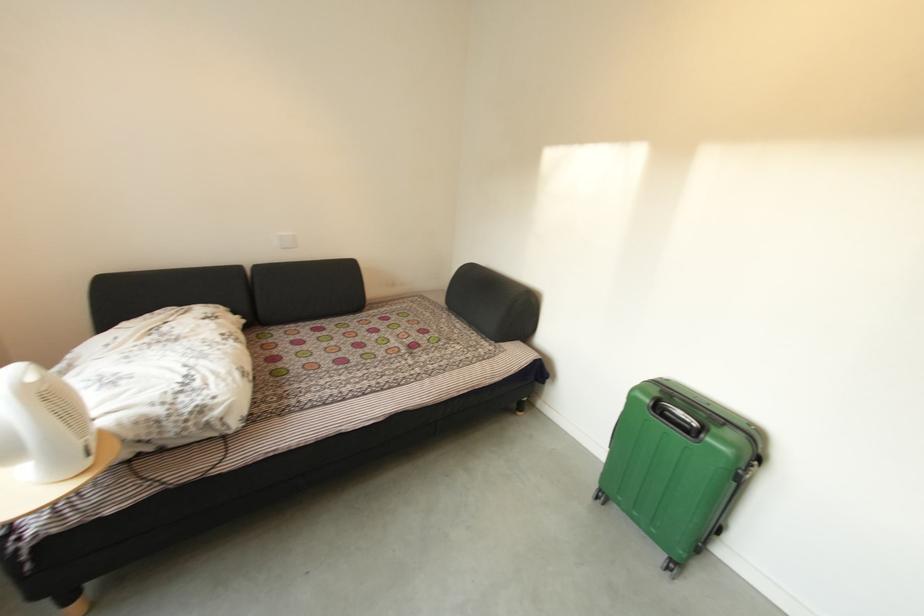
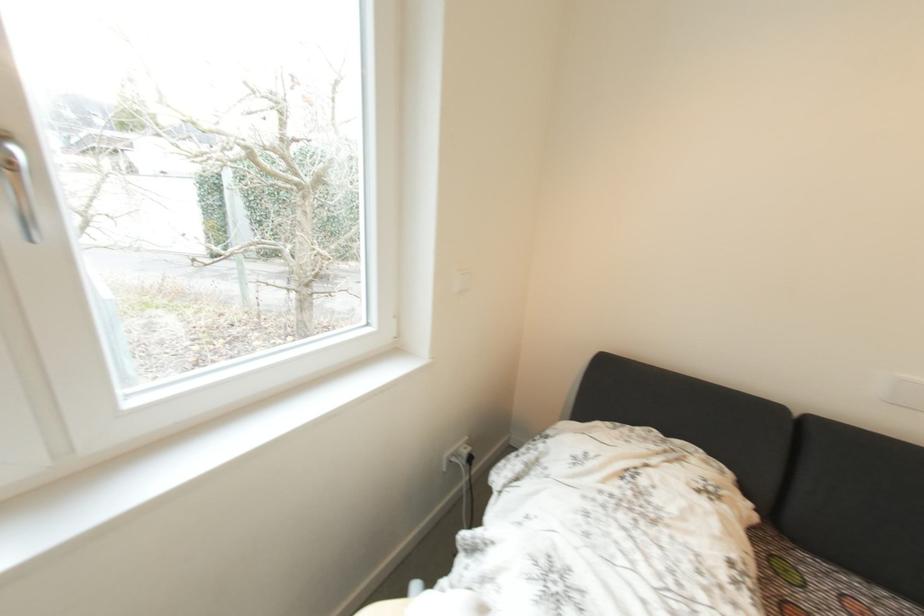
Question: The images are taken continuously from a first-person perspective. In which direction is your viewpoint rotating?

Choices:
 (A) Left
 (B) Right
 (C) Up
 (D) Down

Answer: (A)